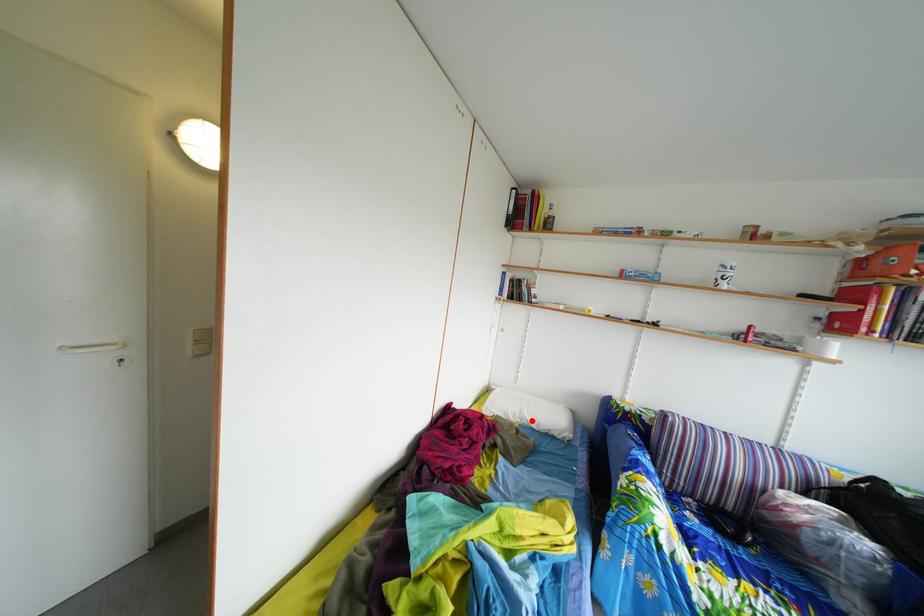
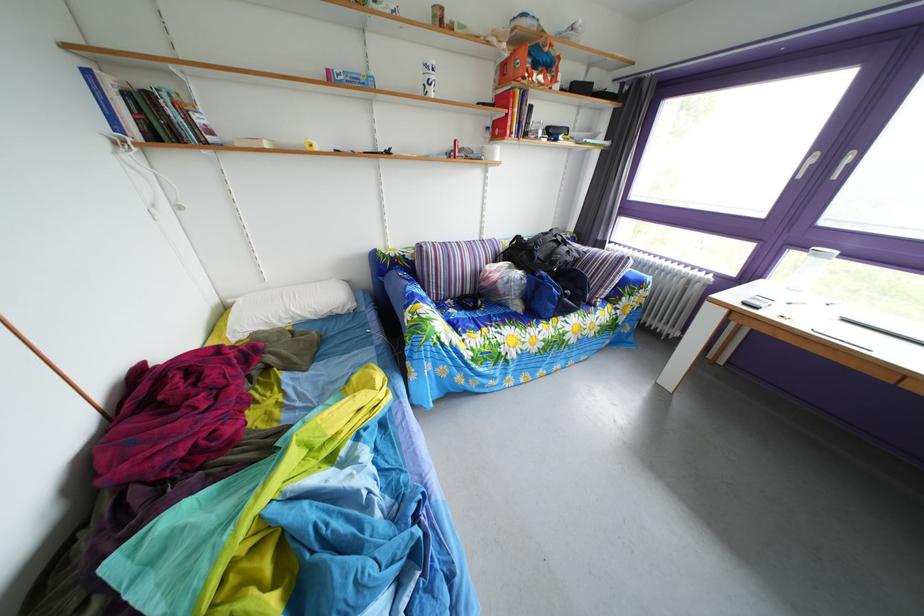
Locate, in the second image, the point that corresponds to the highlighted location in the first image.

(298, 320)